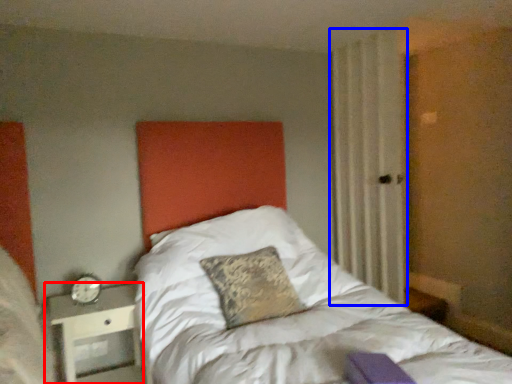
Question: Which of the following is the closest to the observer, nightstand (highlighted by a red box) or curtain (highlighted by a blue box)?

Choices:
 (A) nightstand
 (B) curtain

Answer: (A)